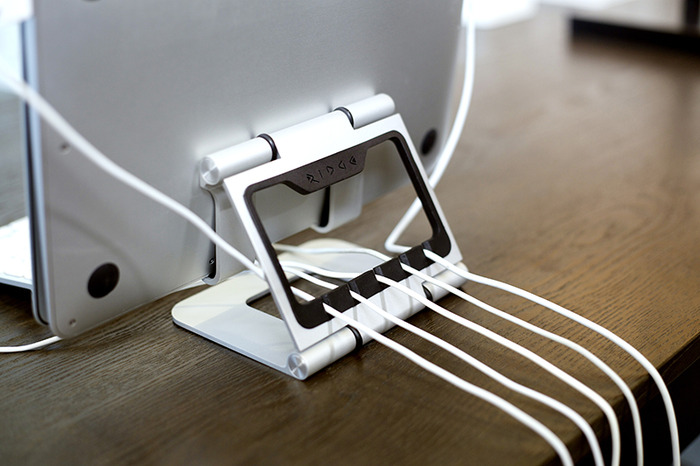
Identify the location of wires. (404, 353), (449, 346), (484, 332), (505, 317), (526, 294).